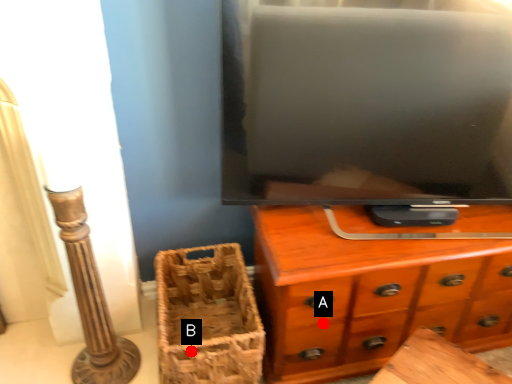
Question: Two points are circled on the image, labeled by A and B beside each circle. Which point is farther to the camera?

Choices:
 (A) A is further
 (B) B is further

Answer: (A)